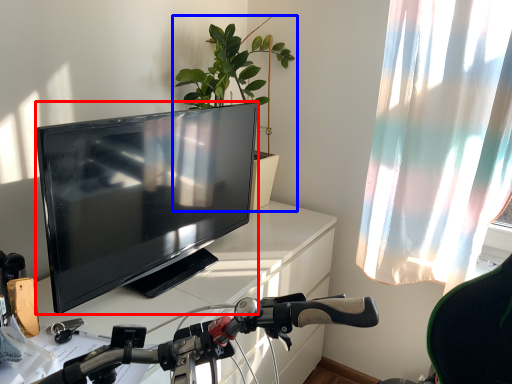
Question: Which point is further to the camera, television (highlighted by a red box) or houseplant (highlighted by a blue box)?

Choices:
 (A) television
 (B) houseplant

Answer: (B)